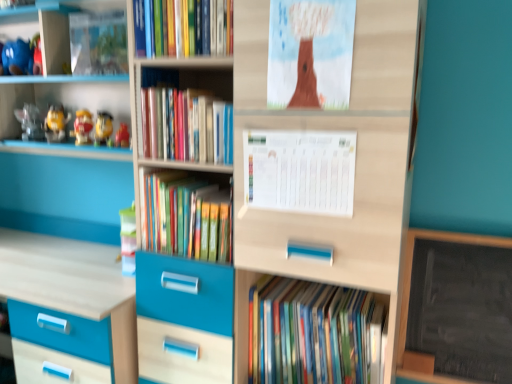
Looking at this image, how much space does brown paper at upper center, arranged as the 1th paperback book when viewed from the top, occupy vertically?

It is 13.71 inches.

The image size is (512, 384). Identify the location of matte yellow toy at upper left, which is the second toy in right-to-left order. (82, 127).

This screenshot has height=384, width=512. I want to click on hardcover books at center, which ranks as the 1th book in bottom-to-top order, so click(x=313, y=334).

The width and height of the screenshot is (512, 384). Describe the element at coordinates (183, 27) in the screenshot. I see `hardcover books at upper center, acting as the 4th book starting from the bottom` at that location.

I want to click on hardcover books at center, which appears as the 3th book when ordered from the bottom, so click(185, 126).

Looking at this image, in order to face hardcover books at center, the second book when ordered from top to bottom, should I rotate leftwards or rightwards?

Rotate your view left by about 7.028°.

How much space does matte blue piggy bank at upper left, positioned as the first toy in left-to-right order, occupy vertically?

matte blue piggy bank at upper left, positioned as the first toy in left-to-right order, is 6.89 inches tall.

Find the location of a particular element. This screenshot has width=512, height=384. yellow matte minion at left, arranged as the 2th toy when viewed from the left is located at coordinates (56, 124).

What do you see at coordinates (185, 217) in the screenshot?
I see `hardcover books at center, marked as the 2th book in a bottom-to-top arrangement` at bounding box center [185, 217].

The height and width of the screenshot is (384, 512). In order to click on brown paper at upper center, arranged as the 1th paperback book when viewed from the top in this screenshot , I will do `click(310, 53)`.

Find the location of `toy that is the 4th object located behind the hardcover books at center, the second book when ordered from top to bottom`. toy that is the 4th object located behind the hardcover books at center, the second book when ordered from top to bottom is located at coordinates (22, 57).

From the image's perspective, is matte blue piggy bank at upper left, positioned as the first toy in left-to-right order, on top of hardcover books at center, which appears as the 3th book when ordered from the bottom?

Correct, matte blue piggy bank at upper left, positioned as the first toy in left-to-right order, appears higher than hardcover books at center, which appears as the 3th book when ordered from the bottom, in the image.

Considering the sizes of objects matte blue piggy bank at upper left, the 4th toy when ordered from right to left, and hardcover books at center, the second book when ordered from top to bottom, in the image provided, who is wider, matte blue piggy bank at upper left, the 4th toy when ordered from right to left, or hardcover books at center, the second book when ordered from top to bottom,?

Wider between the two is hardcover books at center, the second book when ordered from top to bottom.

Is matte blue piggy bank at upper left, the 4th toy when ordered from right to left, inside the boundaries of hardcover books at center, which appears as the 3th book when ordered from the bottom, or outside?

matte blue piggy bank at upper left, the 4th toy when ordered from right to left, is not enclosed by hardcover books at center, which appears as the 3th book when ordered from the bottom.

Are white paper calendar at center, the 1th paperback book in the bottom-to-top sequence, and hardcover books at center, which appears as the 3th book when ordered from the bottom, beside each other?

white paper calendar at center, the 1th paperback book in the bottom-to-top sequence, and hardcover books at center, which appears as the 3th book when ordered from the bottom, are not in contact.

I want to click on the 1st book above the white paper calendar at center, which is the second paperback book in top-to-bottom order (from the image's perspective), so click(185, 126).

Does point (268, 206) come behind point (166, 127)?

No, (268, 206) is in front of (166, 127).

Based on the photo, does matte yellow toy at upper left, which is the second toy in right-to-left order, have a greater height compared to matte yellow toy at left, positioned as the fourth toy in left-to-right order?

Yes, matte yellow toy at upper left, which is the second toy in right-to-left order, is taller than matte yellow toy at left, positioned as the fourth toy in left-to-right order.

Locate an element on the screen. toy on the right of matte yellow toy at upper left, which is the 3th toy from left to right is located at coordinates (103, 128).

Which is correct: matte yellow toy at upper left, which is the second toy in right-to-left order, is inside matte yellow toy at left, the 1th toy from the right, or outside of it?

matte yellow toy at upper left, which is the second toy in right-to-left order, is outside matte yellow toy at left, the 1th toy from the right.

Is matte yellow toy at left, positioned as the fourth toy in left-to-right order, at the back of matte yellow toy at upper left, which is the second toy in right-to-left order?

No, matte yellow toy at left, positioned as the fourth toy in left-to-right order, is not at the back of matte yellow toy at upper left, which is the second toy in right-to-left order.

Can you confirm if yellow matte minion at left, arranged as the 2th toy when viewed from the left, is thinner than matte yellow toy at upper left, which is the 3th toy from left to right?

Yes, yellow matte minion at left, arranged as the 2th toy when viewed from the left, is thinner than matte yellow toy at upper left, which is the 3th toy from left to right.

From the image's perspective, is yellow matte minion at left, which ranks as the 3th toy in right-to-left order, below matte yellow toy at upper left, which is the second toy in right-to-left order?

No.

Is yellow matte minion at left, which ranks as the 3th toy in right-to-left order, located outside matte yellow toy at upper left, which is the second toy in right-to-left order?

Yes, yellow matte minion at left, which ranks as the 3th toy in right-to-left order, is not within matte yellow toy at upper left, which is the second toy in right-to-left order.

Is point (84, 129) closer or farther from the camera than point (208, 19)?

Point (84, 129) appears to be farther away from the viewer than point (208, 19).

Is matte yellow toy at upper left, which is the second toy in right-to-left order, outside of hardcover books at upper center, acting as the 4th book starting from the bottom?

Yes.

Between matte yellow toy at upper left, which is the second toy in right-to-left order, and hardcover books at upper center, acting as the 4th book starting from the bottom, which one appears on the right side from the viewer's perspective?

hardcover books at upper center, acting as the 4th book starting from the bottom.

Who is shorter, white paper calendar at center, which is the second paperback book in top-to-bottom order, or brown paper at upper center, positioned as the 2th paperback book in bottom-to-top order?

white paper calendar at center, which is the second paperback book in top-to-bottom order.

What's the angular difference between white paper calendar at center, which is the second paperback book in top-to-bottom order, and brown paper at upper center, positioned as the 2th paperback book in bottom-to-top order,'s facing directions?

The angular difference between white paper calendar at center, which is the second paperback book in top-to-bottom order, and brown paper at upper center, positioned as the 2th paperback book in bottom-to-top order, is 0.00578 degrees.

Is white paper calendar at center, the 1th paperback book in the bottom-to-top sequence, not within brown paper at upper center, positioned as the 2th paperback book in bottom-to-top order?

white paper calendar at center, the 1th paperback book in the bottom-to-top sequence, is positioned outside brown paper at upper center, positioned as the 2th paperback book in bottom-to-top order.

Looking at this image, visually, is white paper calendar at center, which is the second paperback book in top-to-bottom order, positioned to the left or to the right of brown paper at upper center, positioned as the 2th paperback book in bottom-to-top order?

Clearly, white paper calendar at center, which is the second paperback book in top-to-bottom order, is on the left of brown paper at upper center, positioned as the 2th paperback book in bottom-to-top order, in the image.

Starting from the white paper calendar at center, which is the second paperback book in top-to-bottom order, which toy is the 2nd one behind? Please provide its 2D coordinates.

[(82, 127)]

Considering the relative sizes of white paper calendar at center, the 1th paperback book in the bottom-to-top sequence, and matte yellow toy at upper left, which is the 3th toy from left to right, in the image provided, is white paper calendar at center, the 1th paperback book in the bottom-to-top sequence, shorter than matte yellow toy at upper left, which is the 3th toy from left to right,?

No.

From the image's perspective, which one is positioned higher, white paper calendar at center, the 1th paperback book in the bottom-to-top sequence, or matte yellow toy at upper left, which is the 3th toy from left to right?

matte yellow toy at upper left, which is the 3th toy from left to right.

Is white paper calendar at center, the 1th paperback book in the bottom-to-top sequence, further to camera compared to matte yellow toy at upper left, which is the second toy in right-to-left order?

That is False.

Which toy is the 4th one when counting from the back of the hardcover books at center, which appears as the 3th book when ordered from the bottom? Please provide its 2D coordinates.

[(22, 57)]

What are the coordinates of `paperback book that is the 1st one when counting forward from the hardcover books at center, which appears as the 3th book when ordered from the bottom` in the screenshot? It's located at (300, 170).

Estimate the real-world distances between objects in this image. Which object is closer to hardcover books at center, the second book when ordered from top to bottom, matte yellow toy at left, positioned as the fourth toy in left-to-right order, or matte yellow toy at upper left, which is the second toy in right-to-left order?

matte yellow toy at left, positioned as the fourth toy in left-to-right order.

When comparing their distances from matte yellow toy at upper left, which is the 3th toy from left to right, does white paper calendar at center, which is the second paperback book in top-to-bottom order, or matte yellow toy at left, positioned as the fourth toy in left-to-right order, seem further?

white paper calendar at center, which is the second paperback book in top-to-bottom order, is further to matte yellow toy at upper left, which is the 3th toy from left to right.

Considering their positions, is matte yellow toy at upper left, which is the 3th toy from left to right, positioned closer to hardcover books at center, the second book when ordered from top to bottom, than hardcover books at center, marked as the 2th book in a bottom-to-top arrangement?

Among the two, hardcover books at center, marked as the 2th book in a bottom-to-top arrangement, is located nearer to hardcover books at center, the second book when ordered from top to bottom.

Which object lies nearer to the anchor point hardcover books at upper center, acting as the 4th book starting from the bottom, hardcover books at center, marked as the 2th book in a bottom-to-top arrangement, or hardcover books at center, which appears as the 3th book when ordered from the bottom?

The object closer to hardcover books at upper center, acting as the 4th book starting from the bottom, is hardcover books at center, which appears as the 3th book when ordered from the bottom.

When comparing their distances from white paper calendar at center, which is the second paperback book in top-to-bottom order, does hardcover books at center, the second book when ordered from top to bottom, or hardcover books at upper center, acting as the 4th book starting from the bottom, seem further?

hardcover books at upper center, acting as the 4th book starting from the bottom, is further to white paper calendar at center, which is the second paperback book in top-to-bottom order.

Looking at the image, which one is located further to hardcover books at center, which ranks as the 1th book in bottom-to-top order, matte blue piggy bank at upper left, positioned as the first toy in left-to-right order, or matte yellow toy at left, the 1th toy from the right?

Based on the image, matte blue piggy bank at upper left, positioned as the first toy in left-to-right order, appears to be further to hardcover books at center, which ranks as the 1th book in bottom-to-top order.

From the image, which object appears to be farther from yellow matte minion at left, which ranks as the 3th toy in right-to-left order, hardcover books at center, marked as the 2th book in a bottom-to-top arrangement, or hardcover books at center, which ranks as the 1th book in bottom-to-top order?

The object further to yellow matte minion at left, which ranks as the 3th toy in right-to-left order, is hardcover books at center, which ranks as the 1th book in bottom-to-top order.

Based on their spatial positions, is yellow matte minion at left, which ranks as the 3th toy in right-to-left order, or matte yellow toy at left, the 1th toy from the right, further from hardcover books at center, which ranks as the 1th book in bottom-to-top order?

The object further to hardcover books at center, which ranks as the 1th book in bottom-to-top order, is yellow matte minion at left, which ranks as the 3th toy in right-to-left order.

You are a GUI agent. You are given a task and a screenshot of the screen. Output one action in this format:
    pyautogui.click(x=<x>, y=<y>)
    Task: Click on the paperback book between matte blue piggy bank at upper left, positioned as the first toy in left-to-right order, and brown paper at upper center, arranged as the 1th paperback book when viewed from the top, from left to right
    This screenshot has height=384, width=512.
    Given the screenshot: What is the action you would take?
    pyautogui.click(x=300, y=170)

Locate an element on the screen. The width and height of the screenshot is (512, 384). book between white paper calendar at center, the 1th paperback book in the bottom-to-top sequence, and hardcover books at center, which ranks as the 1th book in bottom-to-top order, from top to bottom is located at coordinates point(185,217).

The image size is (512, 384). Find the location of `paperback book between yellow matte minion at left, which ranks as the 3th toy in right-to-left order, and brown paper at upper center, arranged as the 1th paperback book when viewed from the top, in the horizontal direction`. paperback book between yellow matte minion at left, which ranks as the 3th toy in right-to-left order, and brown paper at upper center, arranged as the 1th paperback book when viewed from the top, in the horizontal direction is located at coordinates (300, 170).

This screenshot has height=384, width=512. Find the location of `paperback book between brown paper at upper center, arranged as the 1th paperback book when viewed from the top, and hardcover books at center, which ranks as the 1th book in bottom-to-top order, in the up-down direction`. paperback book between brown paper at upper center, arranged as the 1th paperback book when viewed from the top, and hardcover books at center, which ranks as the 1th book in bottom-to-top order, in the up-down direction is located at coordinates (300, 170).